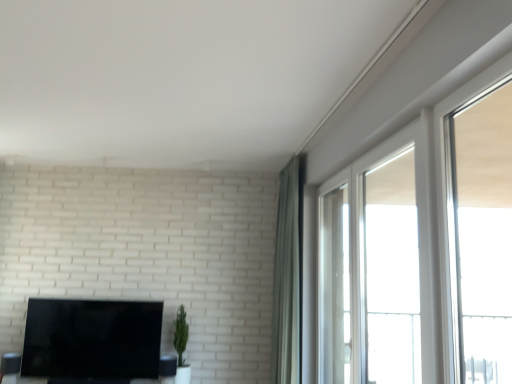
Question: Considering the relative sizes of black glossy tv at lower left and green matte plant at center in the image provided, is black glossy tv at lower left wider than green matte plant at center?

Choices:
 (A) yes
 (B) no

Answer: (B)

Question: Is black glossy tv at lower left turned away from green matte plant at center?

Choices:
 (A) yes
 (B) no

Answer: (B)

Question: From the image's perspective, is black glossy tv at lower left on green matte plant at center?

Choices:
 (A) no
 (B) yes

Answer: (B)

Question: Does black glossy tv at lower left have a larger size compared to green matte plant at center?

Choices:
 (A) yes
 (B) no

Answer: (A)

Question: From the image's perspective, is black glossy tv at lower left located beneath green matte plant at center?

Choices:
 (A) no
 (B) yes

Answer: (A)

Question: Considering the relative positions of black glossy tv at lower left and green matte plant at center in the image provided, is black glossy tv at lower left to the right of green matte plant at center from the viewer's perspective?

Choices:
 (A) yes
 (B) no

Answer: (B)

Question: Does green fabric curtain at upper right have a larger size compared to green matte plant at center?

Choices:
 (A) yes
 (B) no

Answer: (A)

Question: Is green fabric curtain at upper right oriented towards green matte plant at center?

Choices:
 (A) yes
 (B) no

Answer: (A)

Question: Considering the relative sizes of green fabric curtain at upper right and green matte plant at center in the image provided, is green fabric curtain at upper right taller than green matte plant at center?

Choices:
 (A) no
 (B) yes

Answer: (B)

Question: Can you confirm if green fabric curtain at upper right is positioned to the left of green matte plant at center?

Choices:
 (A) yes
 (B) no

Answer: (B)

Question: Is green fabric curtain at upper right not inside green matte plant at center?

Choices:
 (A) no
 (B) yes

Answer: (B)

Question: Is green fabric curtain at upper right next to green matte plant at center?

Choices:
 (A) yes
 (B) no

Answer: (B)

Question: Can green fabric curtain at upper right be found inside clear glass window at upper right, the 2th window in the front-to-back sequence?

Choices:
 (A) no
 (B) yes

Answer: (A)